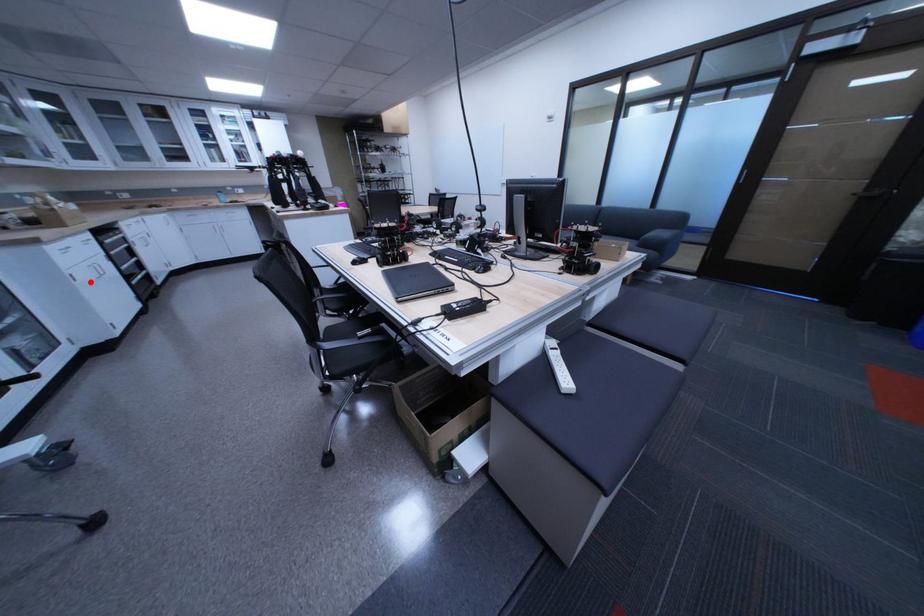
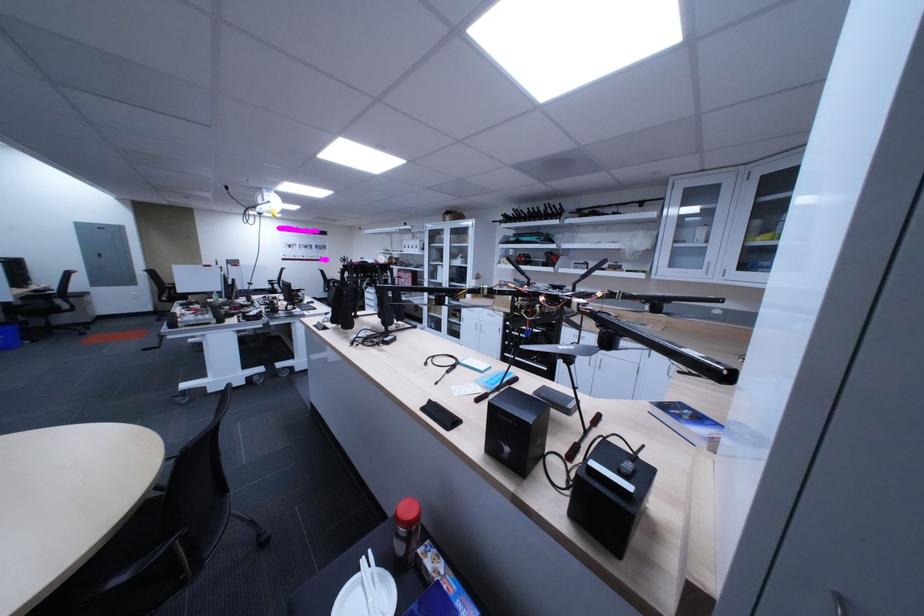
Locate, in the second image, the point that corresponds to the highlighted location in the first image.

(478, 323)